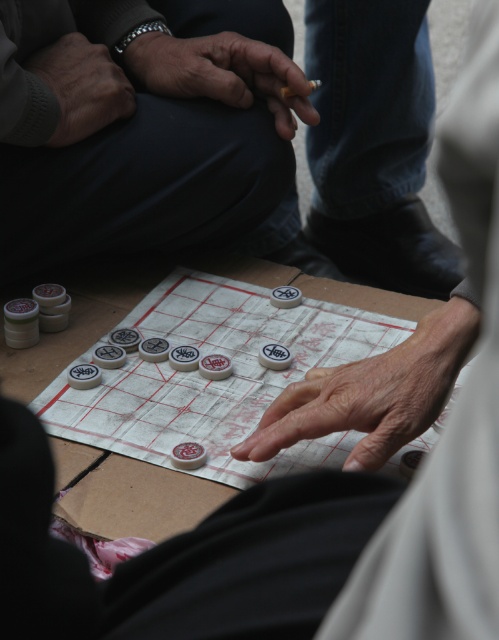
Please provide the coordinates of the gray knit sweater at upper left in the image.

The gray knit sweater at upper left is located at coordinates point [81,86].

You are a player in the game of Chinese chess and want to move your piece from the current position to the opponent. Which direction should you move the piece located at point (243, 51) to reach point (311, 90)?

To move the piece from point (243, 51) to point (311, 90), you should move it diagonally forward, as point (243, 51) is in front of point (311, 90).